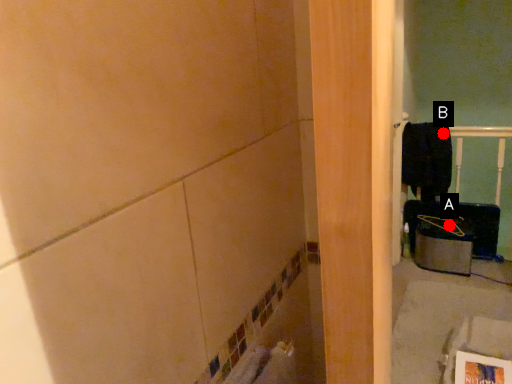
Question: Two points are circled on the image, labeled by A and B beside each circle. Which point is closer to the camera taking this photo?

Choices:
 (A) A is closer
 (B) B is closer

Answer: (B)